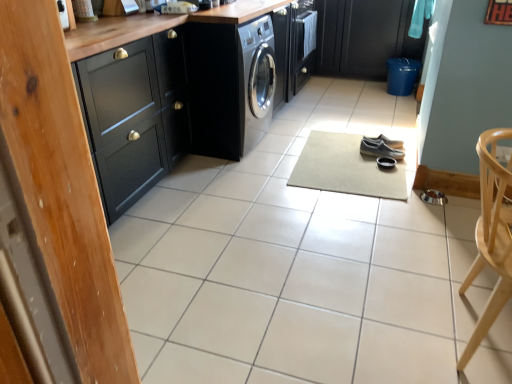
In order to click on space that is in front of satin black washing machine at center in this screenshot , I will do `click(234, 173)`.